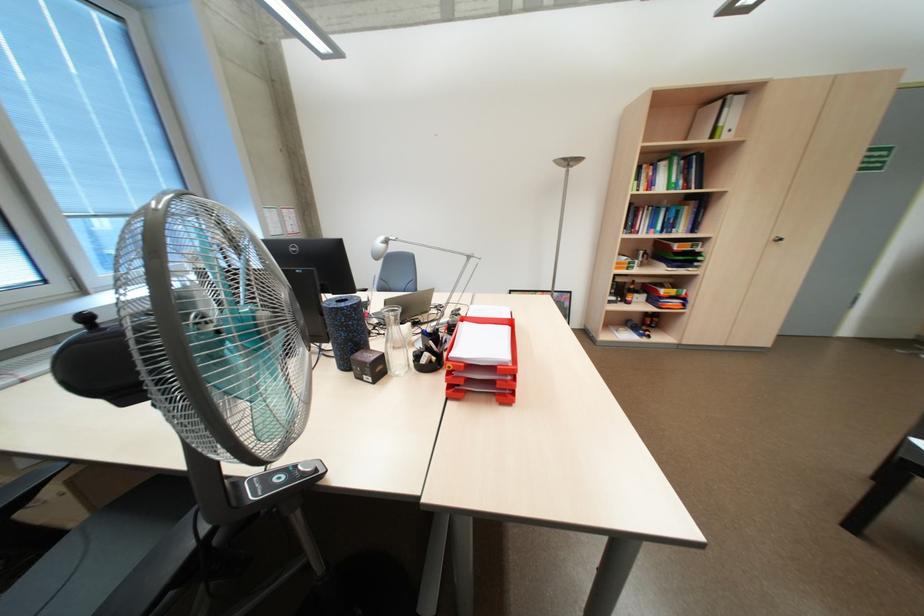
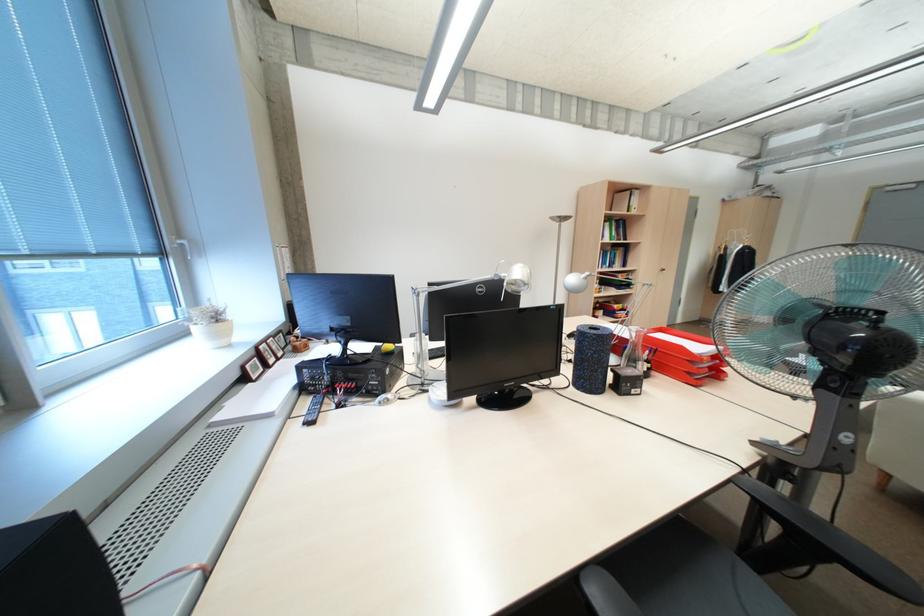
In the second image, find the point that corresponds to point (661, 184) in the first image.

(612, 236)